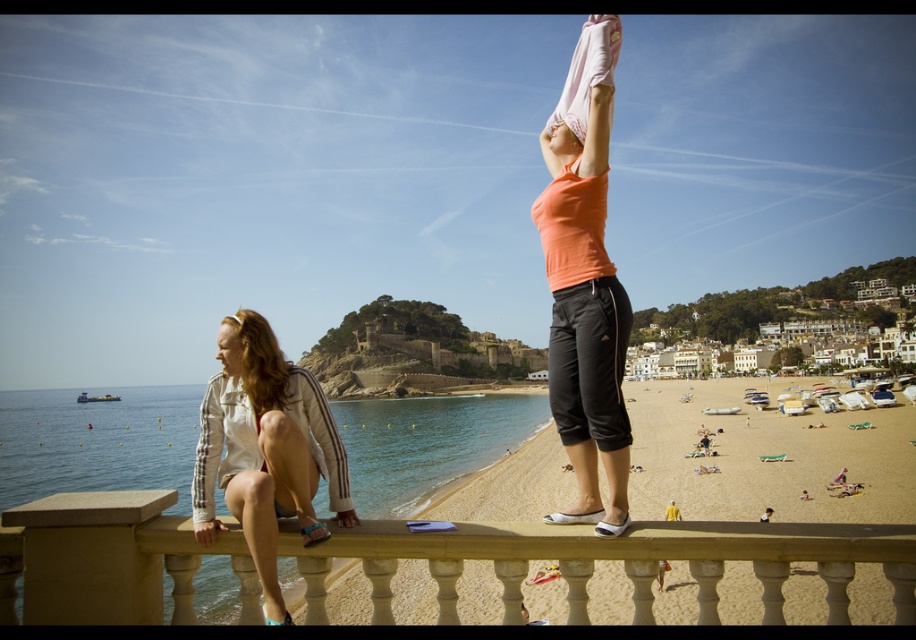
Image resolution: width=916 pixels, height=640 pixels. Find the location of `matte orange tank top at center`. matte orange tank top at center is located at coordinates (585, 342).

What do you see at coordinates (585, 342) in the screenshot?
I see `matte orange tank top at center` at bounding box center [585, 342].

This screenshot has width=916, height=640. In order to click on matte orange tank top at center in this screenshot , I will do point(585,342).

Does beige stone balustrade at center appear on the right side of white cotton jacket at lower left?

Correct, you'll find beige stone balustrade at center to the right of white cotton jacket at lower left.

Is point (518, 524) in front of point (246, 408)?

Yes, point (518, 524) is closer to viewer.

The image size is (916, 640). What are the coordinates of `beige stone balustrade at center` in the screenshot? It's located at (612, 560).

Consider the image. Can you confirm if beige stone balustrade at center is thinner than pink fabric head at upper center?

No, beige stone balustrade at center is not thinner than pink fabric head at upper center.

Is beige stone balustrade at center shorter than pink fabric head at upper center?

No.

At what (x,y) coordinates should I click in order to perform the action: click on beige stone balustrade at center. Please return your answer as a coordinate pair (x, y). The image size is (916, 640). Looking at the image, I should click on (612, 560).

Where is `beige stone balustrade at center`? Image resolution: width=916 pixels, height=640 pixels. beige stone balustrade at center is located at coordinates (612, 560).